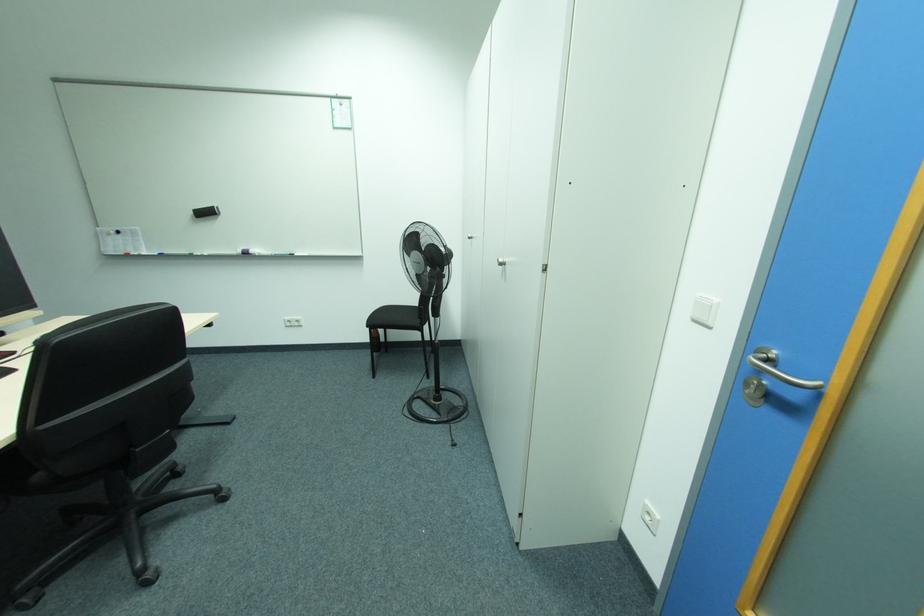
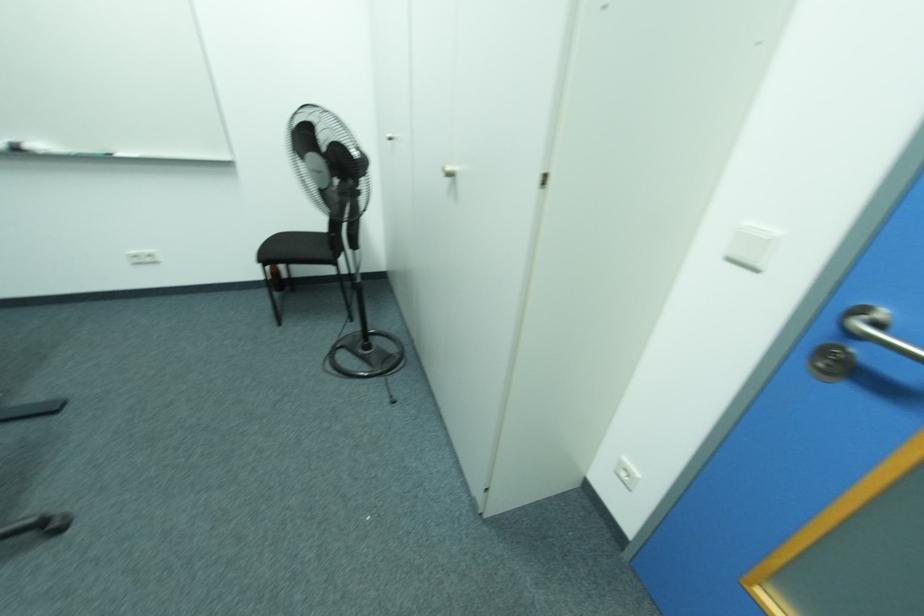
Question: What movement of the cameraman would produce the second image?

Choices:
 (A) Left
 (B) Right
 (C) Forward
 (D) Backward

Answer: (C)